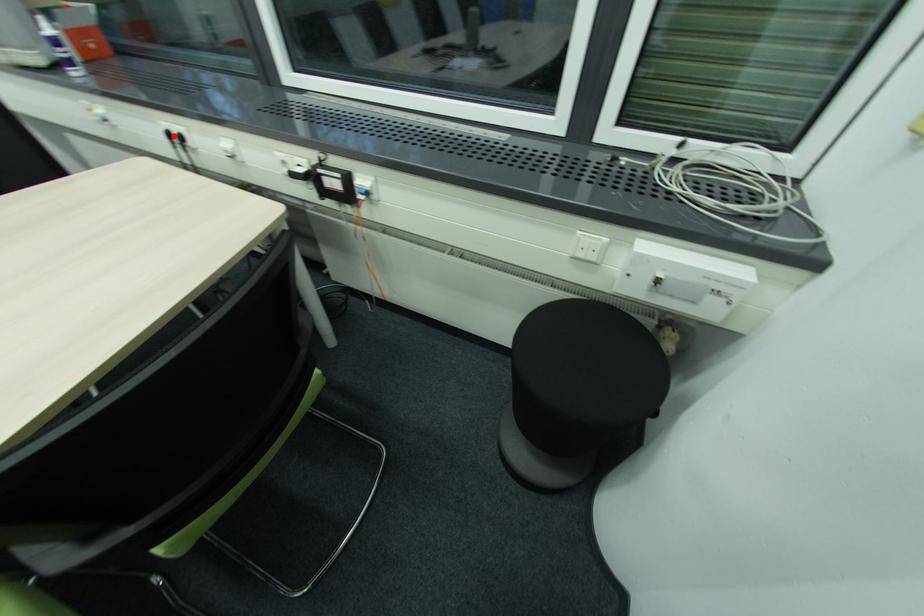
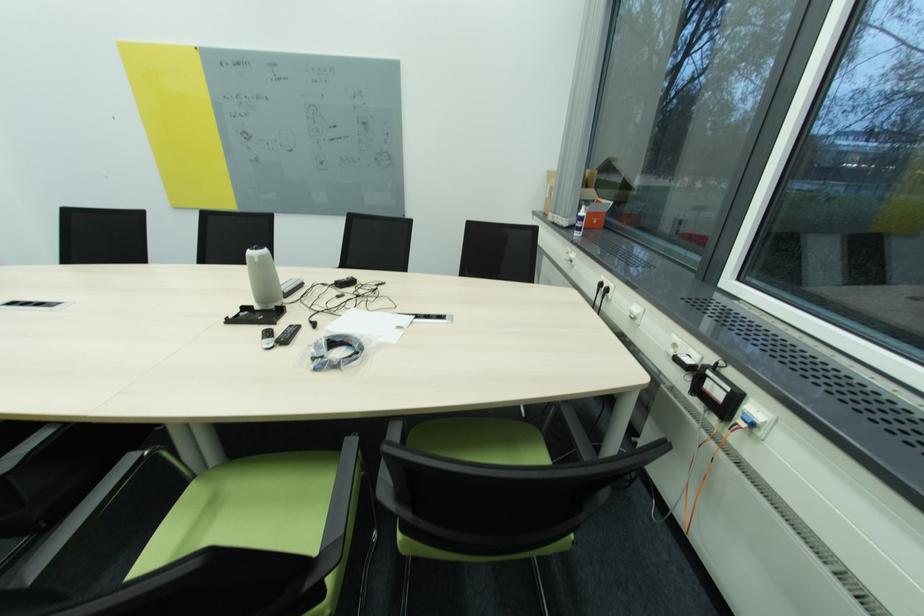
Find the pixel in the second image that matches the highlighted location in the first image.

(604, 286)